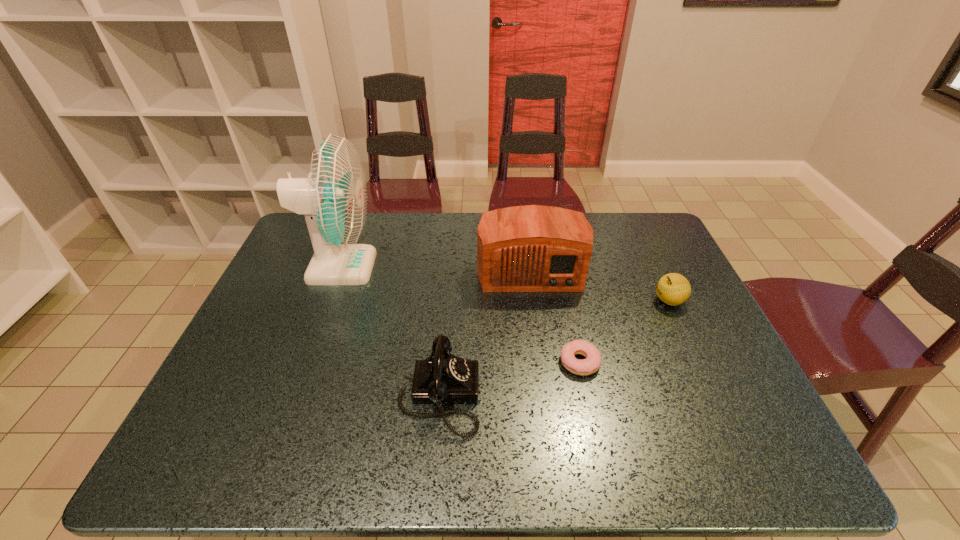
This screenshot has width=960, height=540. Find the location of `the leftmost object`. the leftmost object is located at coordinates (333, 198).

Identify the location of the tallest object. This screenshot has width=960, height=540. (333, 198).

This screenshot has width=960, height=540. Find the location of `radio receiver`. radio receiver is located at coordinates (533, 248).

Find the location of a particular element. The image size is (960, 540). telephone is located at coordinates [442, 377].

You are a GUI agent. You are given a task and a screenshot of the screen. Output one action in this format:
    pyautogui.click(x=<x>, y=<y>)
    Task: Click on the rightmost object
    This screenshot has height=540, width=960.
    Given the screenshot: What is the action you would take?
    pyautogui.click(x=673, y=289)

The height and width of the screenshot is (540, 960). I want to click on softball, so click(673, 289).

At what (x,y) coordinates should I click in order to perform the action: click on doughnut. Please return your answer as a coordinate pair (x, y). This screenshot has width=960, height=540. Looking at the image, I should click on (590, 365).

Locate an element on the screen. Image resolution: width=960 pixels, height=540 pixels. free space located 0.110m in front of the fan to face the airflow is located at coordinates (410, 267).

Locate an element on the screen. free space located 0.290m on the front-facing side of the second tallest object is located at coordinates (545, 383).

In order to click on free space located on the dial of the third tallest object in this screenshot , I will do `click(540, 395)`.